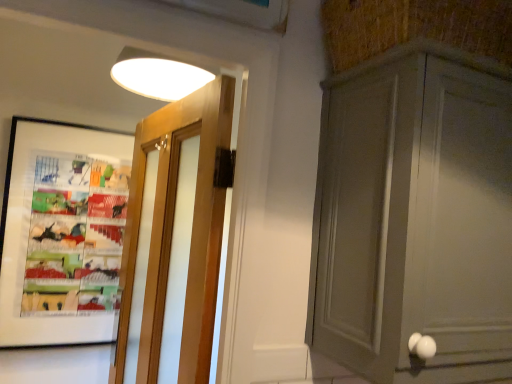
Question: Can you confirm if matte gray cabinet at right is smaller than matte black picture frame at left?

Choices:
 (A) no
 (B) yes

Answer: (A)

Question: Is matte gray cabinet at right further to camera compared to matte black picture frame at left?

Choices:
 (A) yes
 (B) no

Answer: (B)

Question: Can you confirm if matte gray cabinet at right is bigger than matte black picture frame at left?

Choices:
 (A) yes
 (B) no

Answer: (A)

Question: Does matte gray cabinet at right have a greater width compared to matte black picture frame at left?

Choices:
 (A) yes
 (B) no

Answer: (A)

Question: Is matte gray cabinet at right outside of matte black picture frame at left?

Choices:
 (A) yes
 (B) no

Answer: (A)

Question: Is matte black picture frame at left inside or outside of matte gray cabinet at right?

Choices:
 (A) inside
 (B) outside

Answer: (B)

Question: Is matte black picture frame at left taller or shorter than matte gray cabinet at right?

Choices:
 (A) short
 (B) tall

Answer: (B)

Question: From the image's perspective, relative to matte gray cabinet at right, is matte black picture frame at left above or below?

Choices:
 (A) above
 (B) below

Answer: (B)

Question: In terms of size, does matte black picture frame at left appear bigger or smaller than matte gray cabinet at right?

Choices:
 (A) small
 (B) big

Answer: (A)

Question: Considering the positions of point (190, 311) and point (352, 221), is point (190, 311) closer or farther from the camera than point (352, 221)?

Choices:
 (A) farther
 (B) closer

Answer: (A)

Question: From the image's perspective, is wooden door at left positioned above or below matte gray cabinet at right?

Choices:
 (A) above
 (B) below

Answer: (B)

Question: Looking at the image, does wooden door at left seem bigger or smaller compared to matte gray cabinet at right?

Choices:
 (A) small
 (B) big

Answer: (A)

Question: From a real-world perspective, relative to matte gray cabinet at right, is wooden door at left vertically above or below?

Choices:
 (A) below
 (B) above

Answer: (A)

Question: In the image, is matte gray cabinet at right positioned in front of or behind wooden door at left?

Choices:
 (A) front
 (B) behind

Answer: (A)

Question: Considering the positions of matte gray cabinet at right and wooden door at left in the image, is matte gray cabinet at right taller or shorter than wooden door at left?

Choices:
 (A) tall
 (B) short

Answer: (B)